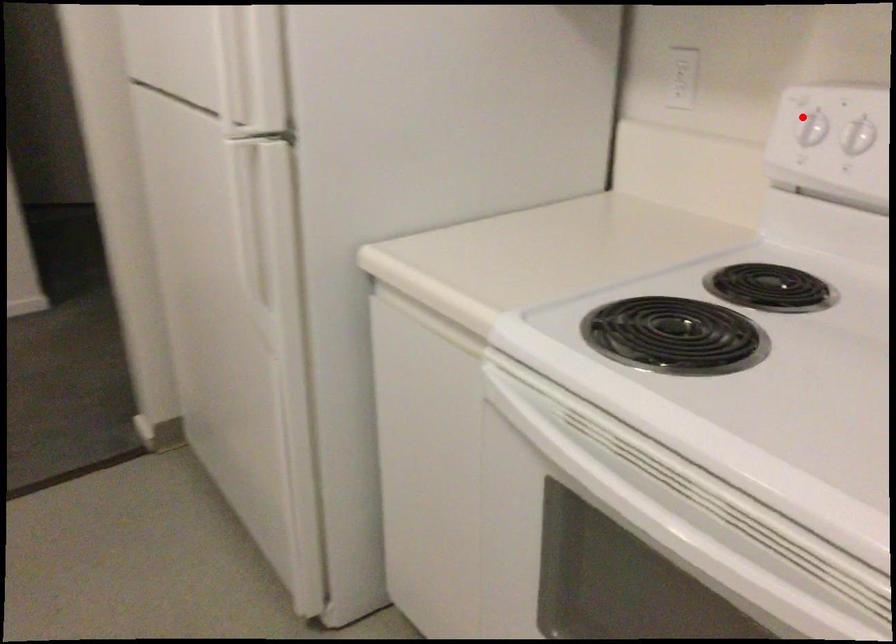
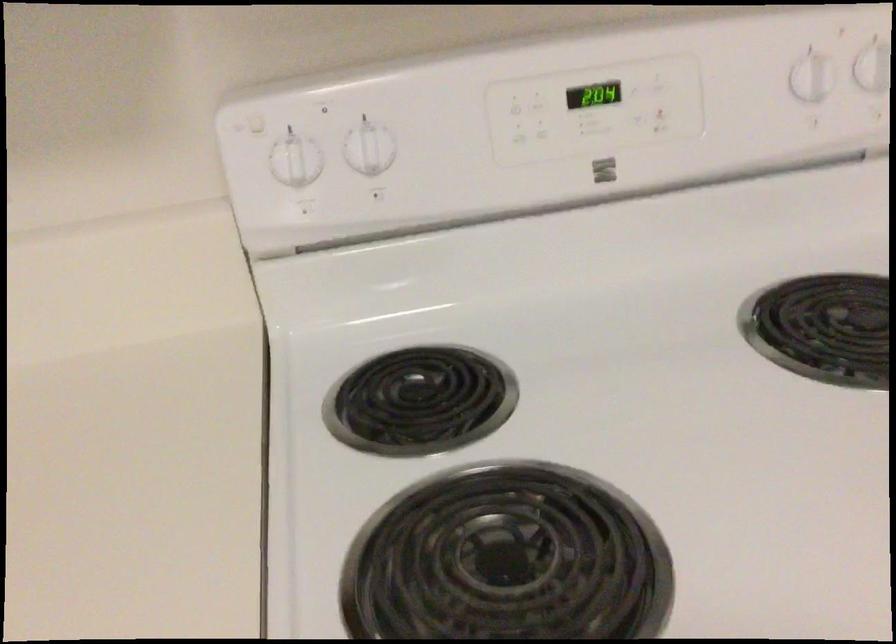
Where in the second image is the point corresponding to the highlighted location from the first image?

(295, 160)